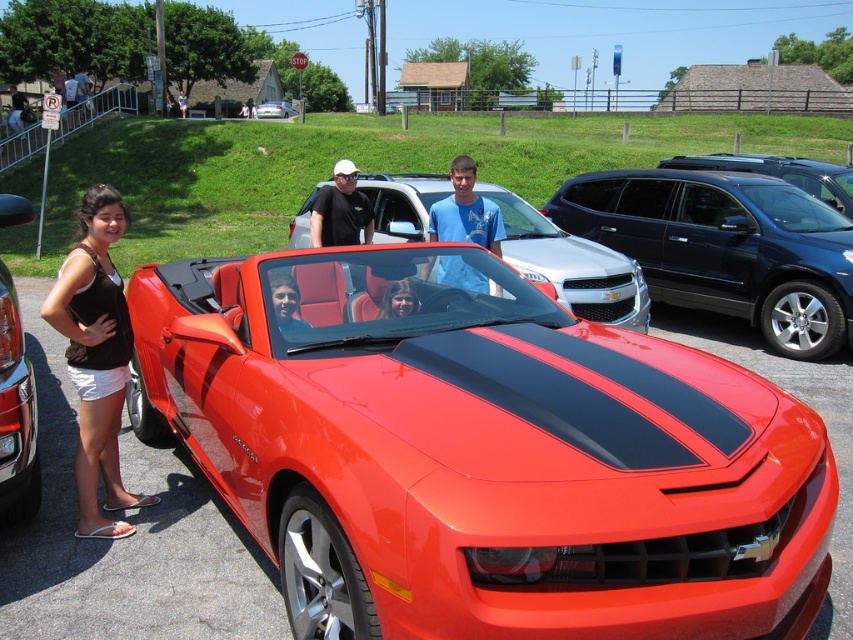
Is shiny red convertible at center shorter than blue cotton shirt at center?

Yes.

Locate an element on the screen. shiny red convertible at center is located at coordinates (570, 264).

Where is `shiny red convertible at center`? This screenshot has width=853, height=640. shiny red convertible at center is located at coordinates (570, 264).

Which is more to the right, glossy orange car at left or glossy metallic car at center?

From the viewer's perspective, glossy orange car at left appears more on the right side.

Who is positioned more to the left, glossy orange car at left or glossy metallic car at center?

glossy metallic car at center is more to the left.

Measure the distance between glossy orange car at left and camera.

glossy orange car at left is 3.54 meters away from camera.

Find the location of a particular element. This screenshot has height=640, width=853. glossy orange car at left is located at coordinates (16, 413).

Does point (796, 330) come in front of point (582, 268)?

No.

The height and width of the screenshot is (640, 853). What do you see at coordinates (724, 248) in the screenshot?
I see `glossy black suv at right` at bounding box center [724, 248].

Does point (578, 230) lie in front of point (618, 257)?

No.

The image size is (853, 640). I want to click on glossy black suv at right, so (724, 248).